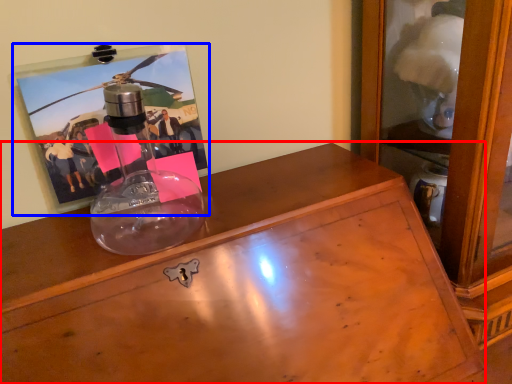
Question: Which object appears closest to the camera in this image, desk (highlighted by a red box) or picture frame (highlighted by a blue box)?

Choices:
 (A) desk
 (B) picture frame

Answer: (A)